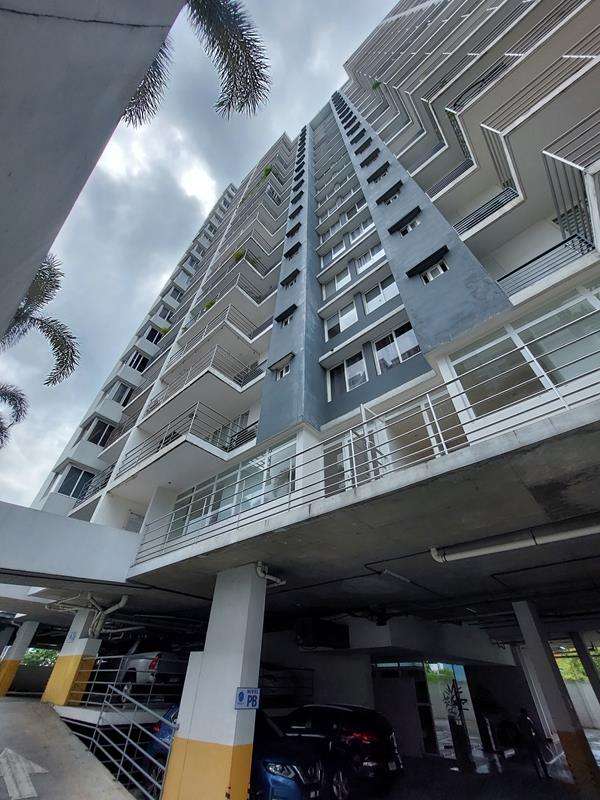
Find the location of a particular element. This screenshot has height=800, width=600. support pillars is located at coordinates (20, 644), (4, 641), (76, 649), (219, 722), (188, 690), (560, 714), (591, 669).